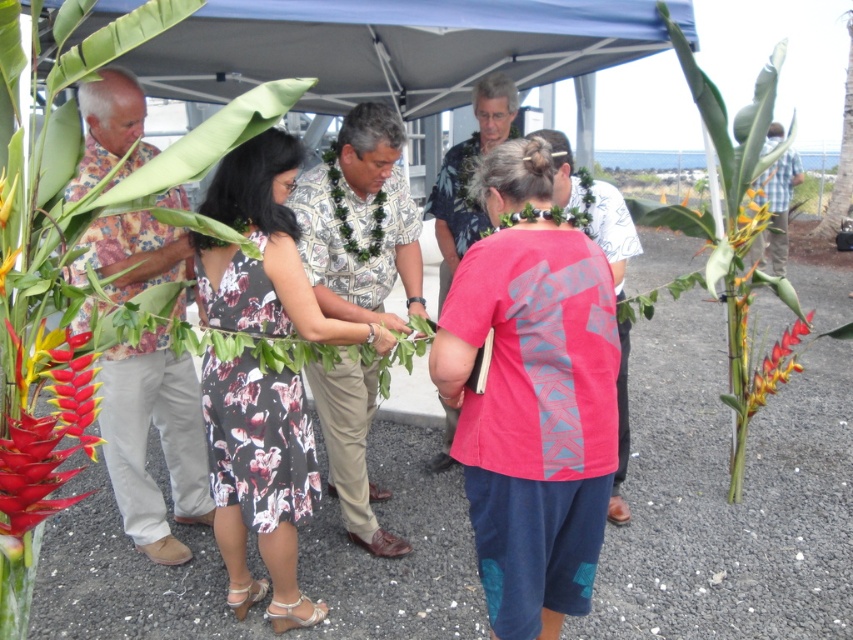
Can you confirm if pink fabric shirt at center is positioned above vibrant red and yellow flower at center?

Indeed, pink fabric shirt at center is positioned over vibrant red and yellow flower at center.

Can you confirm if pink fabric shirt at center is thinner than vibrant red and yellow flower at center?

Incorrect, pink fabric shirt at center's width is not less than vibrant red and yellow flower at center's.

Locate an element on the screen. pink fabric shirt at center is located at coordinates [468, 173].

The image size is (853, 640). What are the coordinates of `pink fabric shirt at center` in the screenshot? It's located at (468, 173).

Does printed fabric shirt at center come in front of vibrant red and yellow flower at center?

Yes, printed fabric shirt at center is closer to the viewer.

Which of these two, printed fabric shirt at center or vibrant red and yellow flower at center, stands shorter?

With less height is vibrant red and yellow flower at center.

Is point (335, 248) closer to camera compared to point (805, 326)?

Yes, point (335, 248) is in front of point (805, 326).

Locate an element on the screen. printed fabric shirt at center is located at coordinates (360, 221).

Who is taller, printed fabric shirt at center or bright orange and yellow petals at center?

printed fabric shirt at center

Is printed fabric shirt at center bigger than bright orange and yellow petals at center?

Yes.

At what (x,y) coordinates should I click in order to perform the action: click on printed fabric shirt at center. Please return your answer as a coordinate pair (x, y). Looking at the image, I should click on (360, 221).